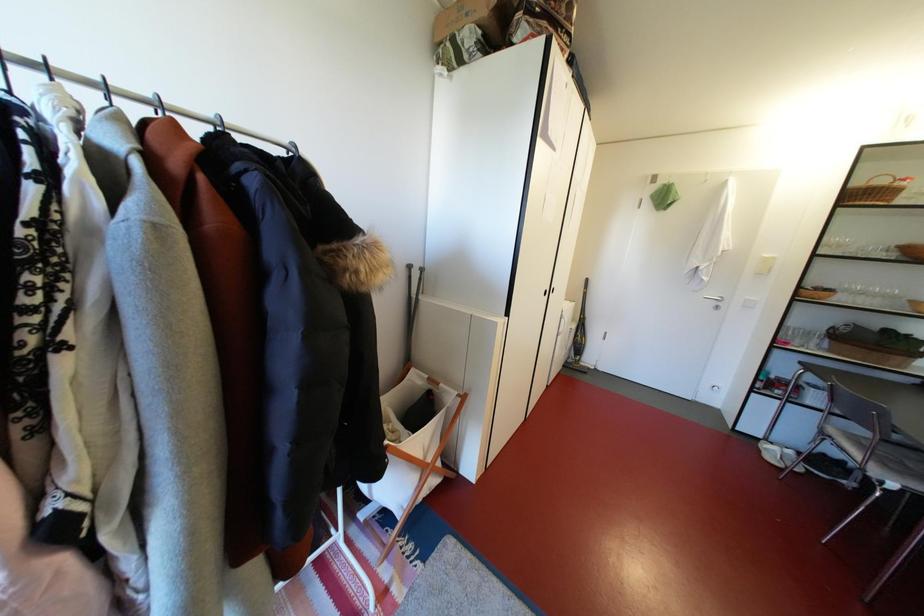
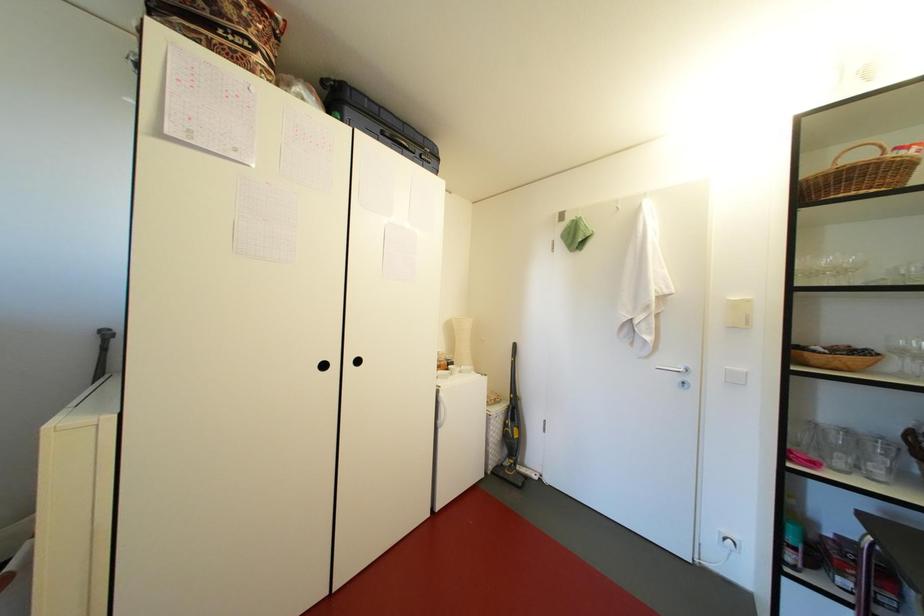
In a continuous first-person perspective shot, in which direction is the camera moving?

The movement direction of the cameraman is right, forward.